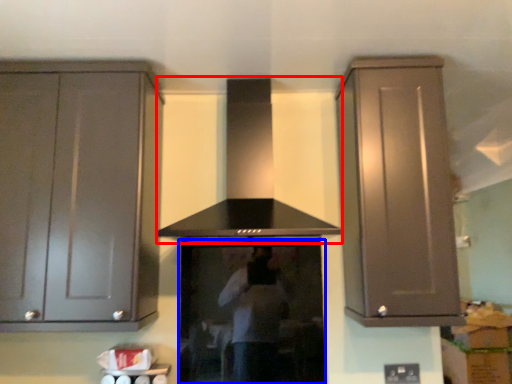
Question: Which point is further to the camera, vent (highlighted by a red box) or appliance (highlighted by a blue box)?

Choices:
 (A) vent
 (B) appliance

Answer: (B)